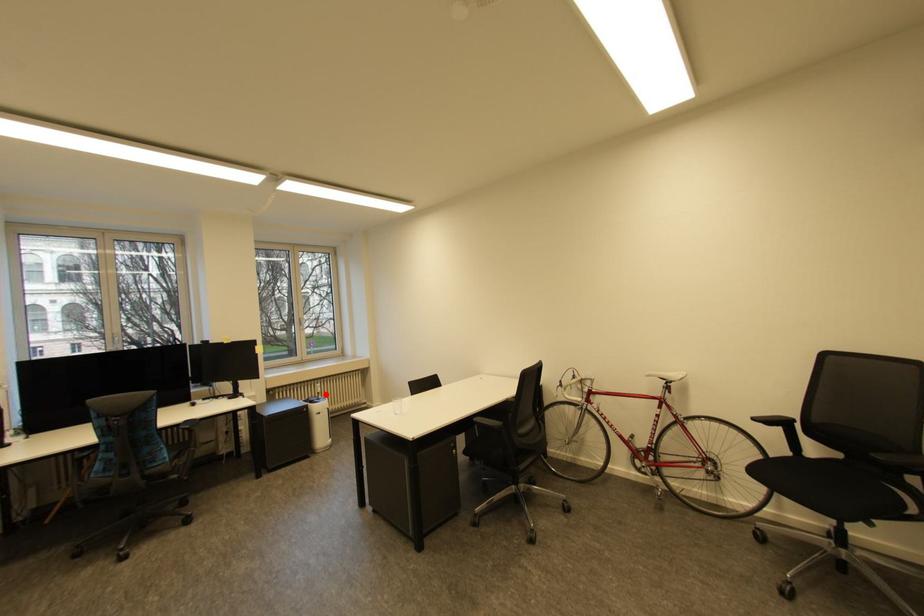
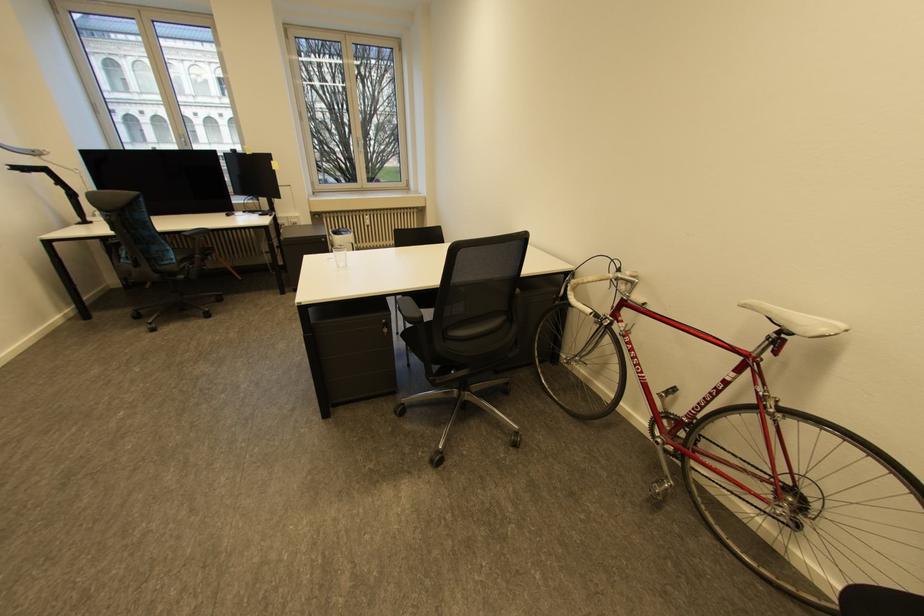
Question: A red point is marked in image1. In image2, is the corresponding 3D point closer to the camera or farther? Reply with the corresponding letter.

Choices:
 (A) The corresponding 3D point is closer.
 (B) The corresponding 3D point is farther.

Answer: (A)